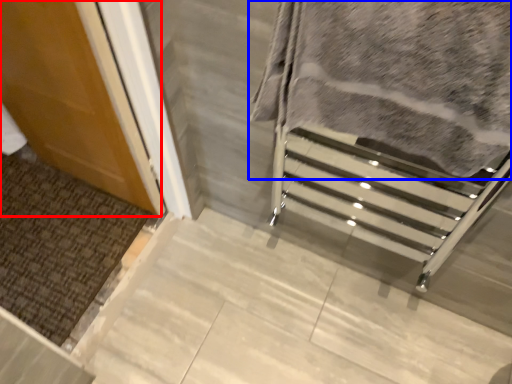
Question: Among these objects, which one is farthest to the camera, door (highlighted by a red box) or blanket (highlighted by a blue box)?

Choices:
 (A) door
 (B) blanket

Answer: (A)